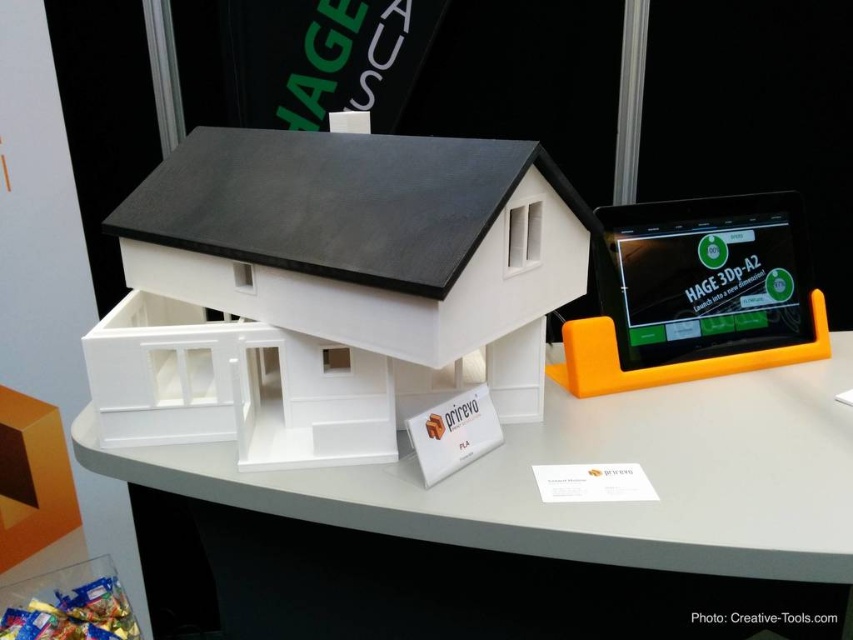
Is white matte table at center shorter than matte black tablet at right?

Yes, white matte table at center is shorter than matte black tablet at right.

Which is behind, point (706, 508) or point (770, 264)?

Positioned behind is point (770, 264).

Locate an element on the screen. The height and width of the screenshot is (640, 853). white matte table at center is located at coordinates (589, 461).